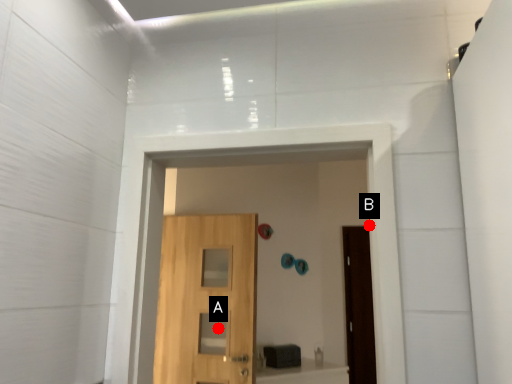
Question: Two points are circled on the image, labeled by A and B beside each circle. Which point is closer to the camera?

Choices:
 (A) A is closer
 (B) B is closer

Answer: (B)